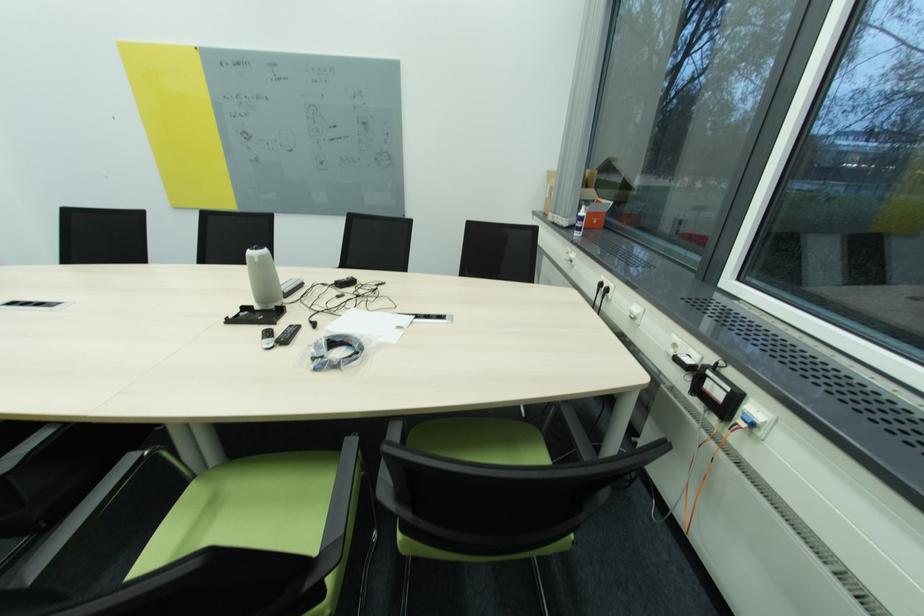
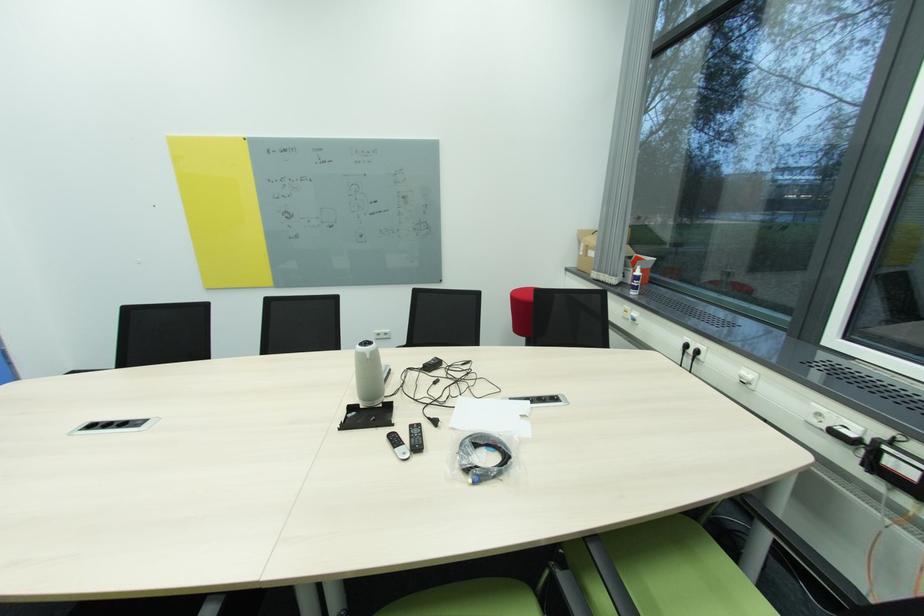
Question: The images are taken continuously from a first-person perspective. In which direction is your viewpoint rotating?

Choices:
 (A) Left
 (B) Right
 (C) Up
 (D) Down

Answer: (C)